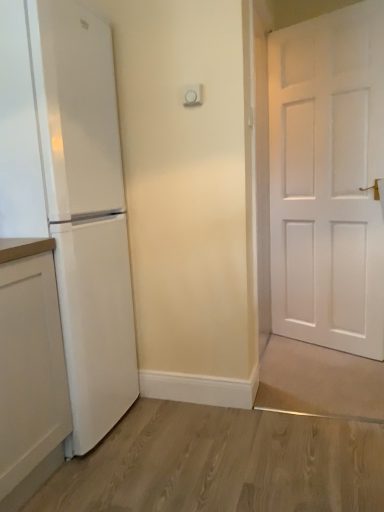
Question: Is white matte refrigerator at left far away from white matte cabinet at left?

Choices:
 (A) no
 (B) yes

Answer: (A)

Question: Does white matte refrigerator at left touch white matte cabinet at left?

Choices:
 (A) yes
 (B) no

Answer: (B)

Question: Can you confirm if white matte refrigerator at left is positioned to the left of white matte cabinet at left?

Choices:
 (A) no
 (B) yes

Answer: (A)

Question: From the image's perspective, is white matte refrigerator at left located beneath white matte cabinet at left?

Choices:
 (A) no
 (B) yes

Answer: (A)

Question: Considering the relative sizes of white matte refrigerator at left and white matte cabinet at left in the image provided, is white matte refrigerator at left shorter than white matte cabinet at left?

Choices:
 (A) no
 (B) yes

Answer: (A)

Question: Is white matte refrigerator at left positioned beyond the bounds of white matte cabinet at left?

Choices:
 (A) yes
 (B) no

Answer: (A)

Question: Considering the relative positions of white matte cabinet at left and white matte refrigerator at left in the image provided, is white matte cabinet at left to the left of white matte refrigerator at left from the viewer's perspective?

Choices:
 (A) yes
 (B) no

Answer: (A)

Question: From a real-world perspective, is white matte cabinet at left on top of white matte refrigerator at left?

Choices:
 (A) no
 (B) yes

Answer: (A)

Question: Can you confirm if white matte cabinet at left is smaller than white matte refrigerator at left?

Choices:
 (A) yes
 (B) no

Answer: (A)

Question: Is white matte cabinet at left located outside white matte refrigerator at left?

Choices:
 (A) yes
 (B) no

Answer: (A)

Question: From the image's perspective, is white matte cabinet at left over white matte refrigerator at left?

Choices:
 (A) no
 (B) yes

Answer: (A)

Question: Considering the relative sizes of white matte cabinet at left and white matte refrigerator at left in the image provided, is white matte cabinet at left shorter than white matte refrigerator at left?

Choices:
 (A) yes
 (B) no

Answer: (A)

Question: Is white matte refrigerator at left in front of or behind white matte cabinet at left in the image?

Choices:
 (A) front
 (B) behind

Answer: (B)